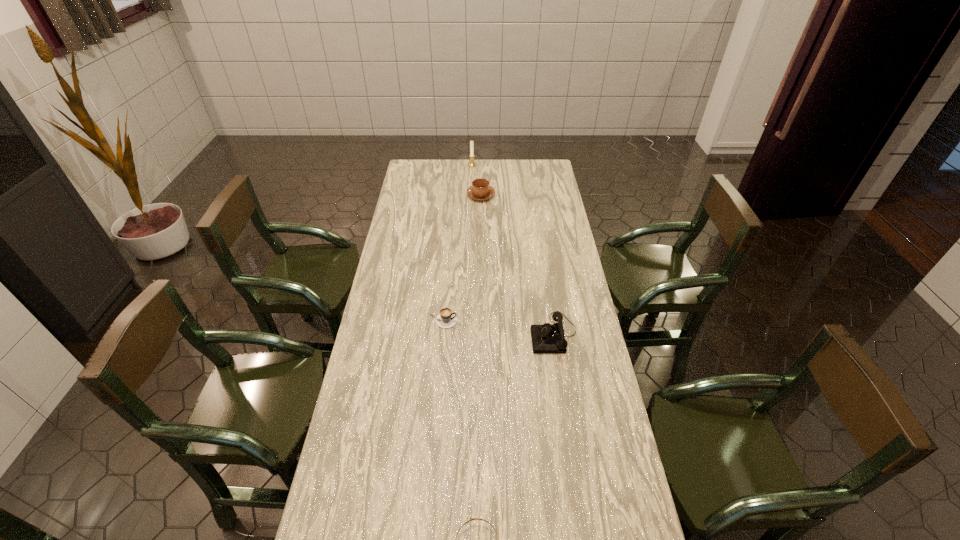
This screenshot has height=540, width=960. I want to click on vacant area at the right edge, so coord(547,249).

In the image, there is a desktop. What are the coordinates of `vacant space at the far right corner` in the screenshot? It's located at (530, 178).

The height and width of the screenshot is (540, 960). I want to click on free point between the candle holder and the shorter cappuccino, so click(457, 243).

Locate an element on the screen. The height and width of the screenshot is (540, 960). vacant area that lies between the candle holder and the rightmost object is located at coordinates (513, 249).

Where is `unoccupied position between the second tallest object and the taller cappuccino`? This screenshot has height=540, width=960. unoccupied position between the second tallest object and the taller cappuccino is located at coordinates (517, 265).

You are a GUI agent. You are given a task and a screenshot of the screen. Output one action in this format:
    pyautogui.click(x=<x>, y=<y>)
    Task: Click on the vacant area that lies between the leftmost object and the candle holder
    
    Given the screenshot: What is the action you would take?
    pyautogui.click(x=457, y=243)

I want to click on vacant area that lies between the fourth nearest object and the telephone, so click(517, 265).

Identify the location of free space between the candle holder and the left cappuccino. The width and height of the screenshot is (960, 540). (457, 243).

I want to click on free area in between the nearer cappuccino and the tallest object, so click(457, 243).

Point out which object is positioned as the fourth nearest to the right cappuccino. Please provide its 2D coordinates. Your answer should be formatted as a tuple, i.e. [(x, y)], where the tuple contains the x and y coordinates of a point satisfying the conditions above.

[(470, 518)]